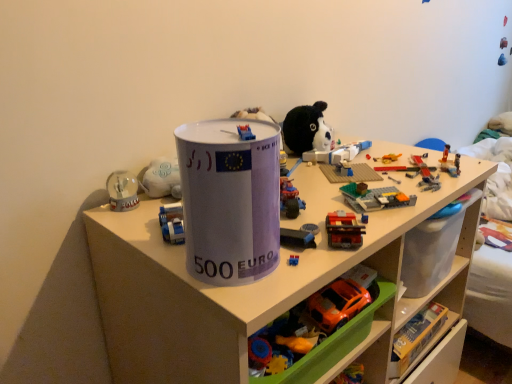
Locate an element on the screen. The width and height of the screenshot is (512, 384). empty space that is ontop of white plastic shelf at center (from a real-world perspective) is located at coordinates (342, 181).